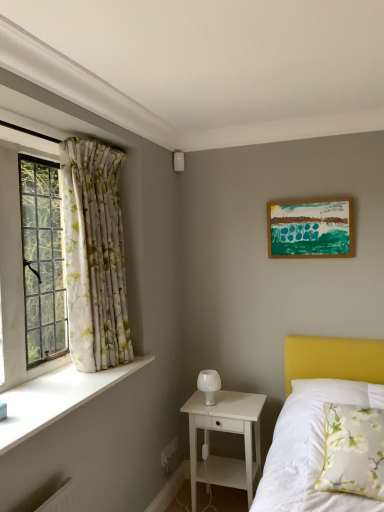
Question: Can we say white smooth window sill at left lies outside wooden picture frame at upper right?

Choices:
 (A) yes
 (B) no

Answer: (A)

Question: Is white smooth window sill at left closer to camera compared to wooden picture frame at upper right?

Choices:
 (A) yes
 (B) no

Answer: (A)

Question: Is white smooth window sill at left further to the viewer compared to wooden picture frame at upper right?

Choices:
 (A) no
 (B) yes

Answer: (A)

Question: Can you confirm if white smooth window sill at left is shorter than wooden picture frame at upper right?

Choices:
 (A) yes
 (B) no

Answer: (A)

Question: From the image's perspective, would you say white smooth window sill at left is positioned over wooden picture frame at upper right?

Choices:
 (A) yes
 (B) no

Answer: (B)

Question: Considering the positions of point (324, 474) and point (215, 391), is point (324, 474) closer or farther from the camera than point (215, 391)?

Choices:
 (A) farther
 (B) closer

Answer: (B)

Question: Is white floral pillow at lower right inside the boundaries of white frosted glass table lamp at center, or outside?

Choices:
 (A) outside
 (B) inside

Answer: (A)

Question: Considering the positions of white floral pillow at lower right and white frosted glass table lamp at center in the image, is white floral pillow at lower right wider or thinner than white frosted glass table lamp at center?

Choices:
 (A) wide
 (B) thin

Answer: (A)

Question: From a real-world perspective, relative to white frosted glass table lamp at center, is white floral pillow at lower right vertically above or below?

Choices:
 (A) above
 (B) below

Answer: (B)

Question: Considering the positions of point (362, 454) and point (190, 440), is point (362, 454) closer or farther from the camera than point (190, 440)?

Choices:
 (A) closer
 (B) farther

Answer: (A)

Question: From a real-world perspective, is white floral pillow at lower right physically located above or below white wood nightstand at lower center?

Choices:
 (A) above
 (B) below

Answer: (A)

Question: In terms of width, does white floral pillow at lower right look wider or thinner when compared to white wood nightstand at lower center?

Choices:
 (A) thin
 (B) wide

Answer: (B)

Question: Relative to white wood nightstand at lower center, is white floral pillow at lower right in front or behind?

Choices:
 (A) front
 (B) behind

Answer: (A)

Question: Is wooden picture frame at upper right to the left or to the right of floral fabric curtain at left in the image?

Choices:
 (A) right
 (B) left

Answer: (A)

Question: Looking at the image, does wooden picture frame at upper right seem bigger or smaller compared to floral fabric curtain at left?

Choices:
 (A) big
 (B) small

Answer: (B)